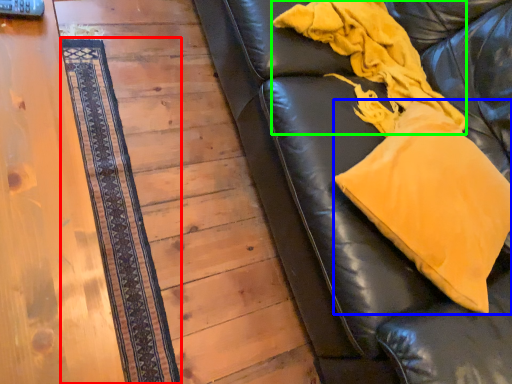
Question: Which object is positioned farthest from mat (highlighted by a red box)? Select from throw pillow (highlighted by a blue box) and blanket (highlighted by a green box).

Choices:
 (A) throw pillow
 (B) blanket

Answer: (A)